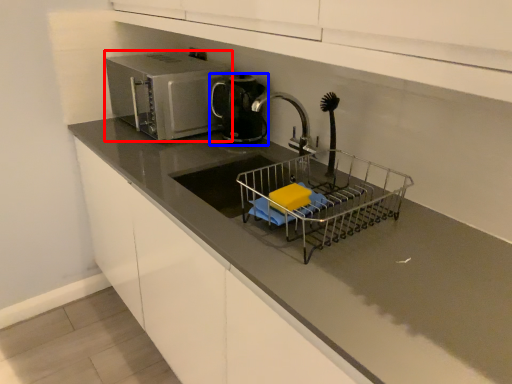
Question: Which object is closer to the camera taking this photo, home appliance (highlighted by a red box) or kitchen appliance (highlighted by a blue box)?

Choices:
 (A) home appliance
 (B) kitchen appliance

Answer: (A)